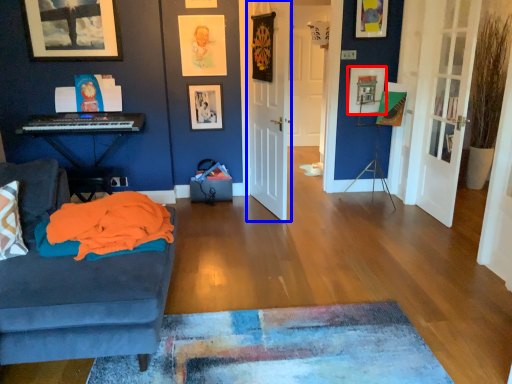
Question: Among these objects, which one is nearest to the camera, picture frame (highlighted by a red box) or door (highlighted by a blue box)?

Choices:
 (A) picture frame
 (B) door

Answer: (B)